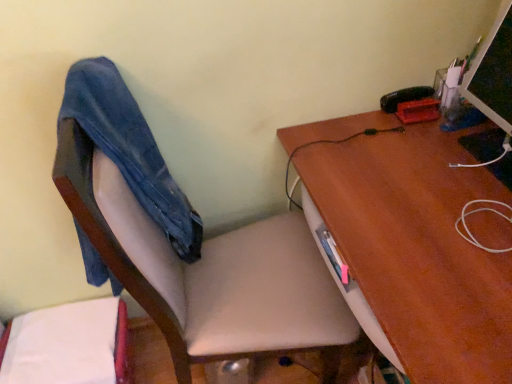
What are the coordinates of `vacant point above brown wood desk at upper right (from a real-world perspective)` in the screenshot? It's located at (431, 195).